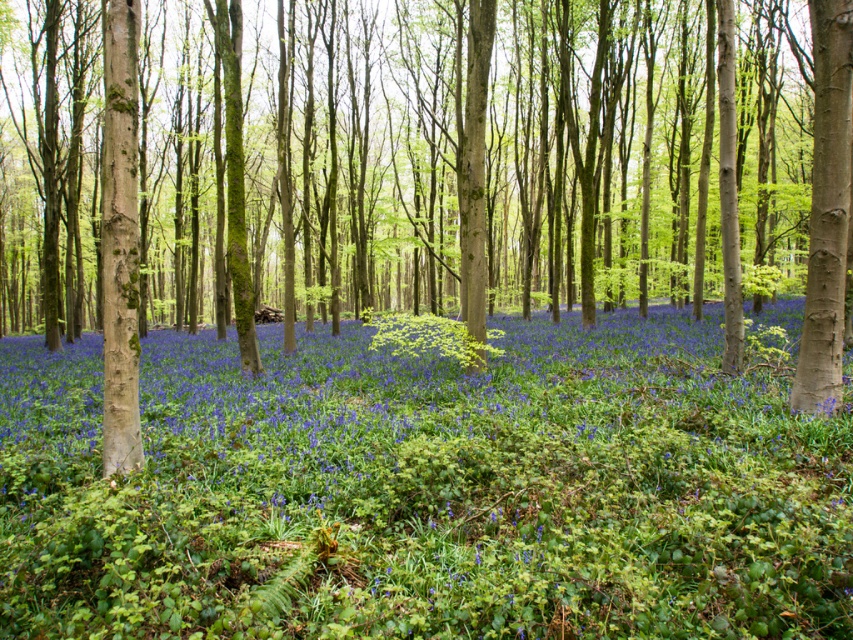
Consider the image. Is the position of blue matte flowers at center less distant than that of vibrant green leaves at center?

Yes.

Who is higher up, blue matte flowers at center or vibrant green leaves at center?

vibrant green leaves at center is higher up.

Is point (805, 612) farther from camera compared to point (474, 355)?

No, (805, 612) is in front of (474, 355).

Find the location of a particular element. blue matte flowers at center is located at coordinates (450, 460).

Can you confirm if blue matte flowers at center is taller than smooth brown tree trunk at right?

In fact, blue matte flowers at center may be shorter than smooth brown tree trunk at right.

Is blue matte flowers at center in front of smooth brown tree trunk at right?

Yes, blue matte flowers at center is closer to the viewer.

Find the location of a particular element. The height and width of the screenshot is (640, 853). blue matte flowers at center is located at coordinates (450, 460).

What are the coordinates of `blue matte flowers at center` in the screenshot? It's located at pyautogui.click(x=450, y=460).

Is smooth brown tree trunk at right smaller than vibrant green leaves at center?

Yes.

Based on the photo, does smooth brown tree trunk at right appear on the right side of vibrant green leaves at center?

Indeed, smooth brown tree trunk at right is positioned on the right side of vibrant green leaves at center.

Between point (834, 76) and point (445, 333), which one is positioned behind?

Point (445, 333)

Where is `smooth brown tree trunk at right`? The image size is (853, 640). smooth brown tree trunk at right is located at coordinates (827, 209).